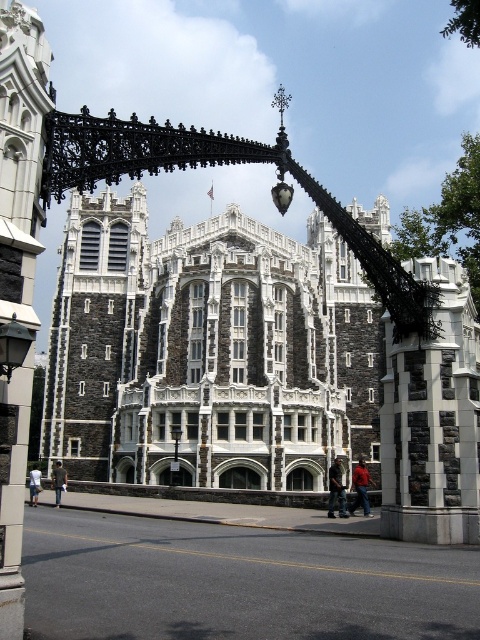
Question: Can you confirm if dark gray stone tower at center is thinner than red leather jacket at lower right?

Choices:
 (A) yes
 (B) no

Answer: (B)

Question: Which object is positioned closest to the dark gray stone tower at center?

Choices:
 (A) stone tower at center
 (B) light blue denim shorts at lower left
 (C) red leather jacket at lower right

Answer: (B)

Question: Which of the following is the closest to the observer?

Choices:
 (A) dark blue jeans at lower center
 (B) stone tower at center

Answer: (B)

Question: Can you confirm if stone tower at center is smaller than light blue denim shorts at lower left?

Choices:
 (A) no
 (B) yes

Answer: (A)

Question: Considering the real-world distances, which object is closest to the light blue denim shorts at lower left?

Choices:
 (A) dark gray jacket at center
 (B) dark gray stone tower at center

Answer: (A)

Question: Does dark blue jeans at lower center have a larger size compared to red leather jacket at lower right?

Choices:
 (A) no
 (B) yes

Answer: (A)